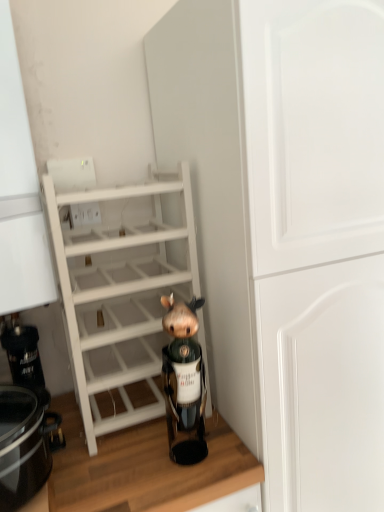
This screenshot has height=512, width=384. In order to click on vacant region in front of white wood shelf at center in this screenshot , I will do `click(142, 470)`.